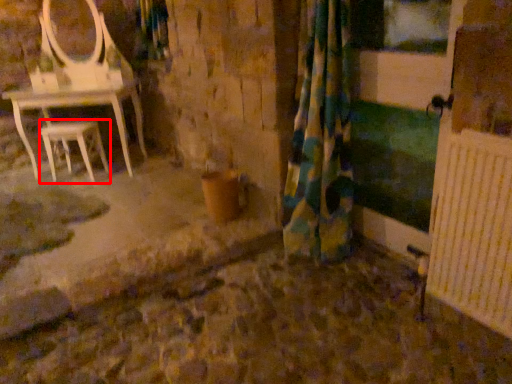
Question: From the image's perspective, considering the relative positions of stool (annotated by the red box) and curtain in the image provided, where is stool (annotated by the red box) located with respect to the staircase?

Choices:
 (A) below
 (B) above

Answer: (B)